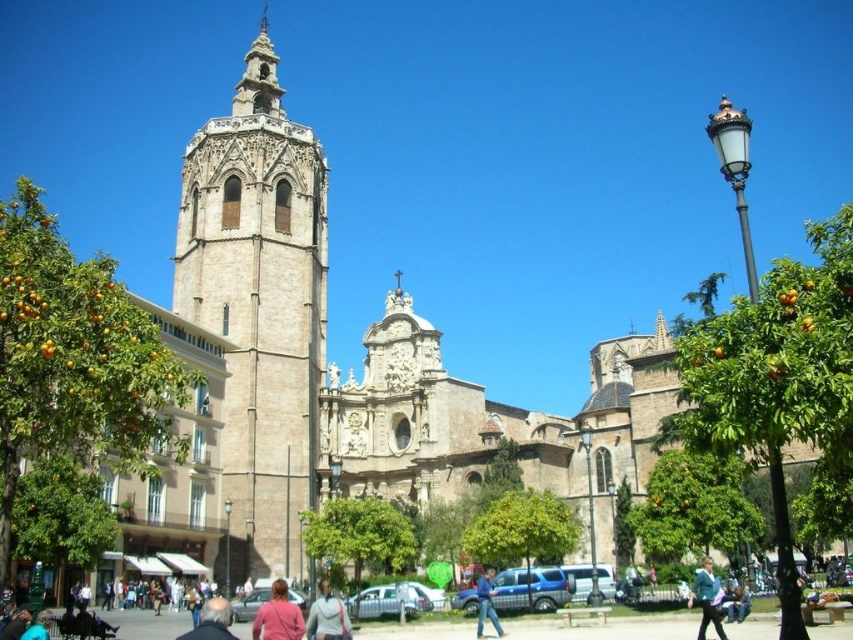
Question: Can you confirm if blue denim jacket at lower right is positioned to the right of blue jeans at lower center?

Choices:
 (A) no
 (B) yes

Answer: (B)

Question: Which object appears farthest from the camera in this image?

Choices:
 (A) blue jeans at lower center
 (B) green leafy tree at right
 (C) orange matte tree at left
 (D) pink fabric at center

Answer: (A)

Question: Is beige stone bell tower at left closer to camera compared to pink fabric at center?

Choices:
 (A) yes
 (B) no

Answer: (B)

Question: Where is dark blue jacket at center located in relation to blue jeans at lower center in the image?

Choices:
 (A) left
 (B) right

Answer: (A)

Question: Considering the real-world distances, which object is farthest from the blue denim jacket at lower right?

Choices:
 (A) orange matte tree at left
 (B) pink fabric at center
 (C) beige stone bell tower at left

Answer: (C)

Question: Estimate the real-world distances between objects in this image. Which object is closer to the blue jeans at lower center?

Choices:
 (A) orange matte tree at left
 (B) beige stone bell tower at left
 (C) dark blue jacket at center
 (D) light gray sweater at center

Answer: (D)